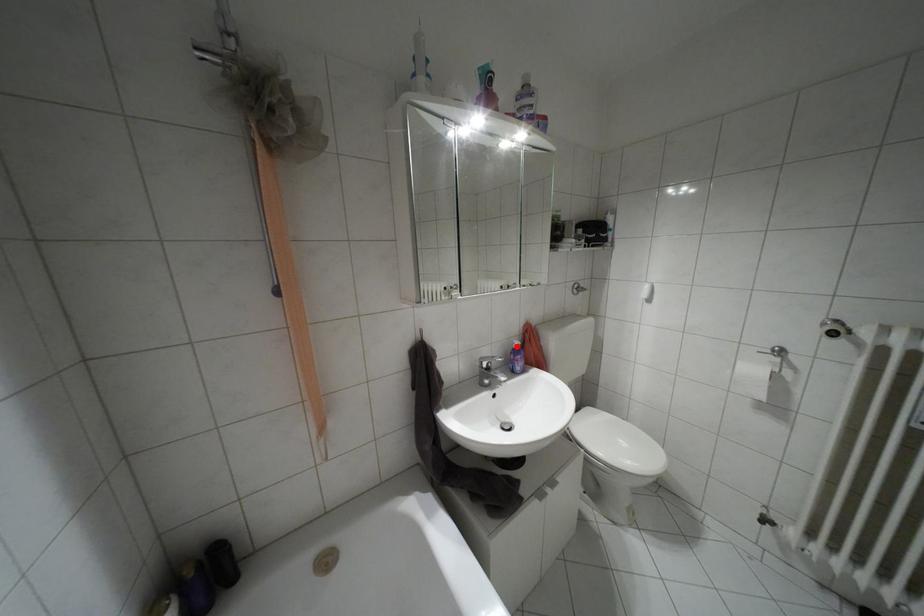
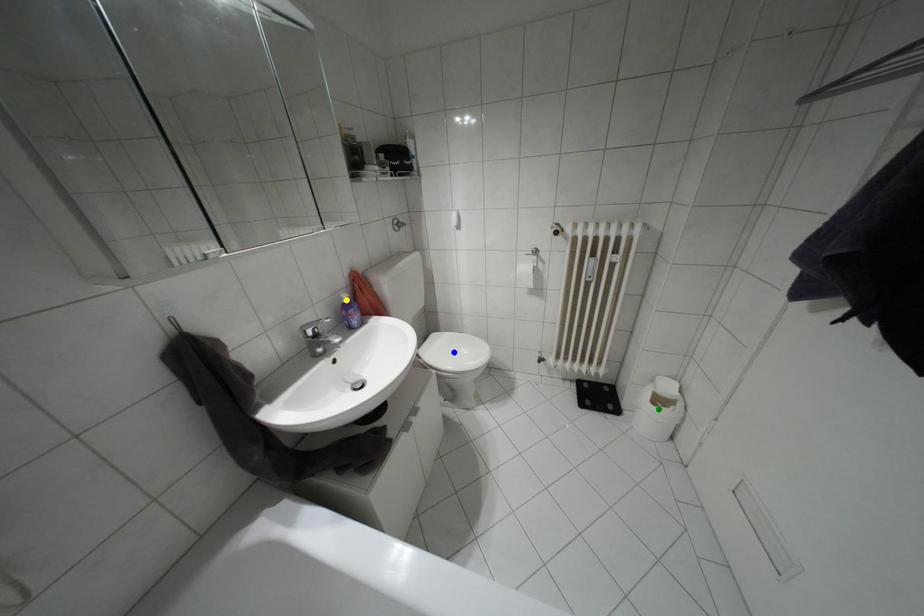
Question: I am providing you with two images of the same scene from different viewpoints. A red point is marked on the first image. You are given multiple points on the second image. Can you choose the point in image 2 that corresponds to the point in image 1?

Choices:
 (A) yellow point
 (B) blue point
 (C) green point

Answer: (A)